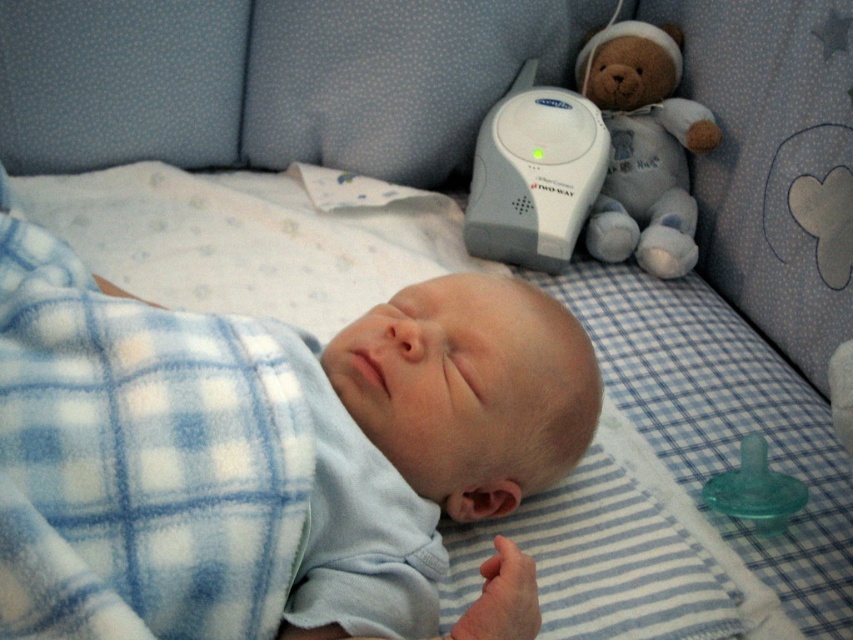
Is the position of soft plush teddy bear at upper right less distant than that of white plastic baby monitor at upper center?

No, soft plush teddy bear at upper right is further to the viewer.

Does point (621, 38) lie in front of point (576, 196)?

No, (621, 38) is further to viewer.

Between point (601, 241) and point (479, 189), which one is positioned behind?

The point (601, 241) is behind.

The image size is (853, 640). I want to click on soft plush teddy bear at upper right, so click(x=643, y=147).

Is point (659, 152) farther from camera compared to point (747, 444)?

Yes, point (659, 152) is farther from viewer.

Which is more to the right, soft plush teddy bear at upper right or green rubber pacifier at lower right?

From the viewer's perspective, green rubber pacifier at lower right appears more on the right side.

Locate an element on the screen. soft plush teddy bear at upper right is located at coordinates (643, 147).

At what (x,y) coordinates should I click in order to perform the action: click on soft plush teddy bear at upper right. Please return your answer as a coordinate pair (x, y). Looking at the image, I should click on (643, 147).

Which of these two, white plastic baby monitor at upper center or green rubber pacifier at lower right, stands shorter?

green rubber pacifier at lower right is shorter.

Does point (527, 132) come closer to viewer compared to point (746, 468)?

No.

Is point (496, 188) behind point (766, 508)?

Yes, point (496, 188) is farther from viewer.

The height and width of the screenshot is (640, 853). Identify the location of white plastic baby monitor at upper center. (534, 173).